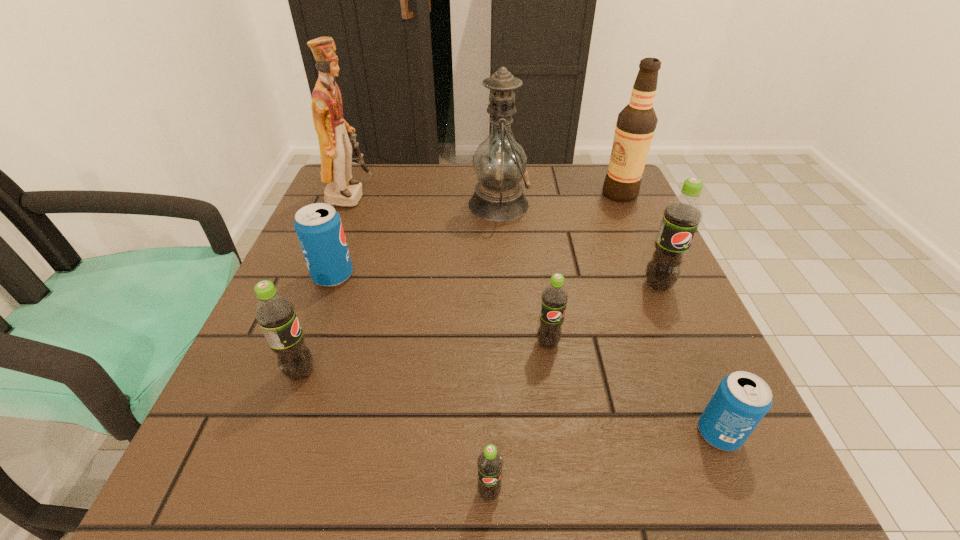
Find the location of a particular element. The width and height of the screenshot is (960, 540). vacant space positioned on the front label of the farthest green soda is located at coordinates (719, 424).

Locate an element on the screen. The height and width of the screenshot is (540, 960). vacant space located on the front label of the fourth farthest soda is located at coordinates point(562,372).

Identify the location of vacant space positioned on the front label of the third biggest green soda. This screenshot has height=540, width=960. (554, 388).

Locate an element on the screen. vacant space located on the back of the left blue soda can is located at coordinates (369, 181).

You are a GUI agent. You are given a task and a screenshot of the screen. Output one action in this format:
    pyautogui.click(x=<x>, y=<y>)
    Task: Click on the vacant point located on the left of the second nearest soda
    This screenshot has width=960, height=540.
    Given the screenshot: What is the action you would take?
    pyautogui.click(x=484, y=434)

The height and width of the screenshot is (540, 960). In order to click on nutcracker at the far edge in this screenshot , I will do `click(334, 134)`.

At what (x,y) coordinates should I click in order to perform the action: click on oil lamp present at the far edge. Please return your answer as a coordinate pair (x, y). Looking at the image, I should click on (499, 162).

What are the coordinates of `alcohol present at the far edge` in the screenshot? It's located at (636, 123).

Where is `nutcracker that is at the left edge`? This screenshot has height=540, width=960. nutcracker that is at the left edge is located at coordinates (334, 134).

This screenshot has height=540, width=960. Identify the location of alcohol that is at the right edge. click(x=636, y=123).